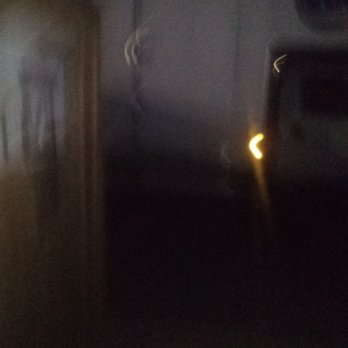
In order to click on brown wall in this screenshot , I will do `click(49, 149)`.